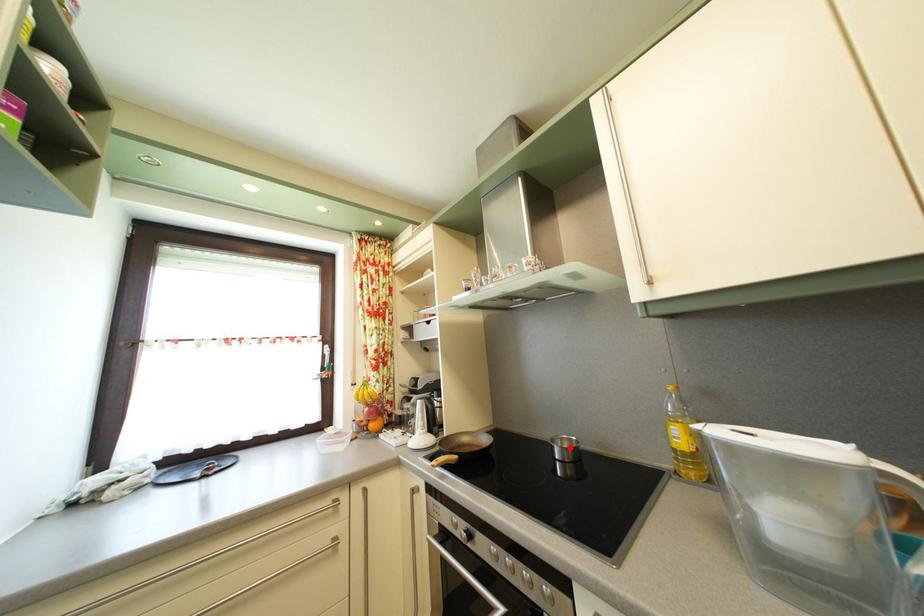
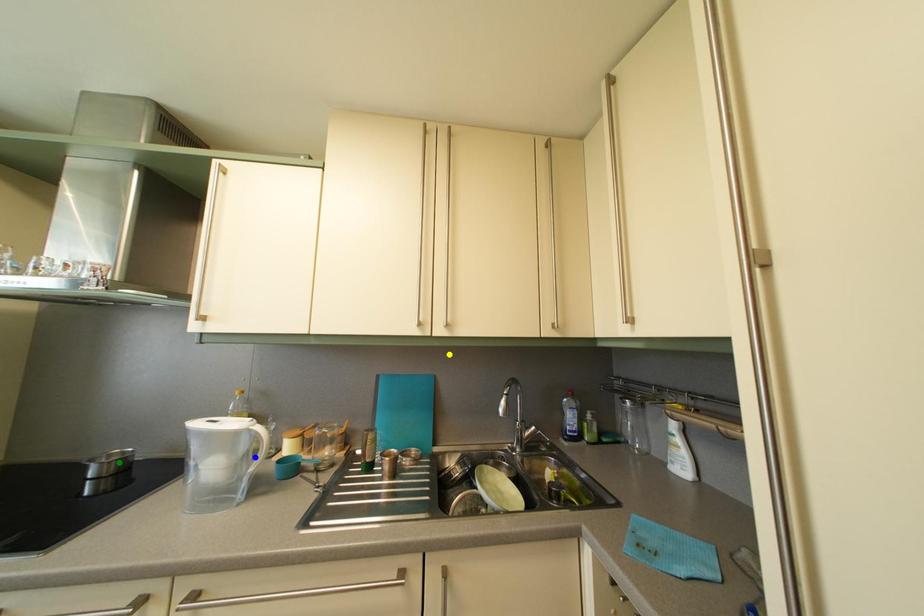
Question: I am providing you with two images of the same scene from different viewpoints. A red point is marked on the first image. You are given multiple points on the second image. Can you choose the point in image 2 that corresponds to the point in image 1?

Choices:
 (A) blue point
 (B) green point
 (C) yellow point

Answer: (B)